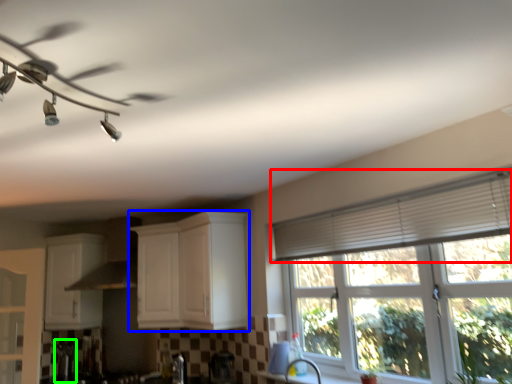
Question: Which object is the farthest from shutter (highlighted by a red box)? Choose among these: cabinetry (highlighted by a blue box) or appliance (highlighted by a green box).

Choices:
 (A) cabinetry
 (B) appliance

Answer: (B)